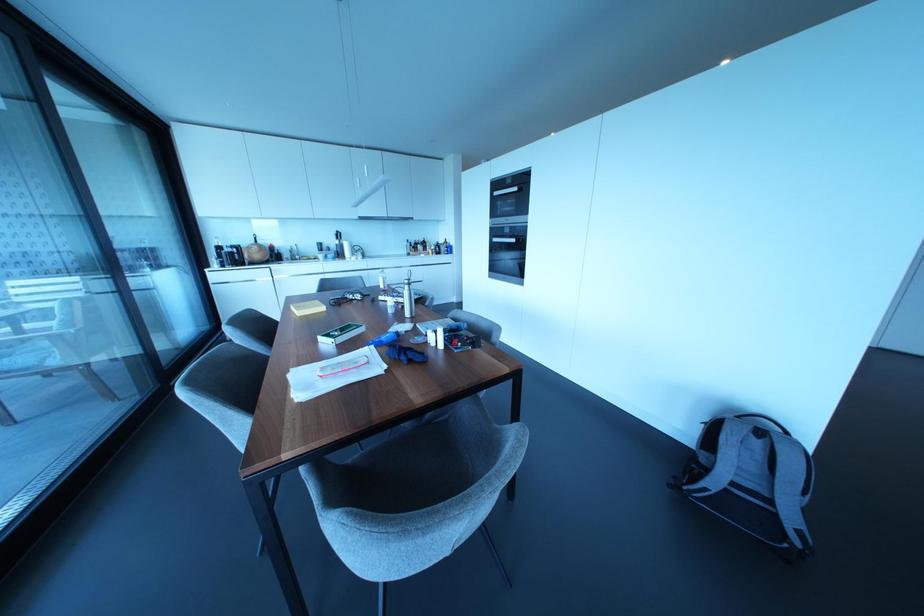
Locate an element on the screen. The height and width of the screenshot is (616, 924). metal water bottle is located at coordinates (407, 299).